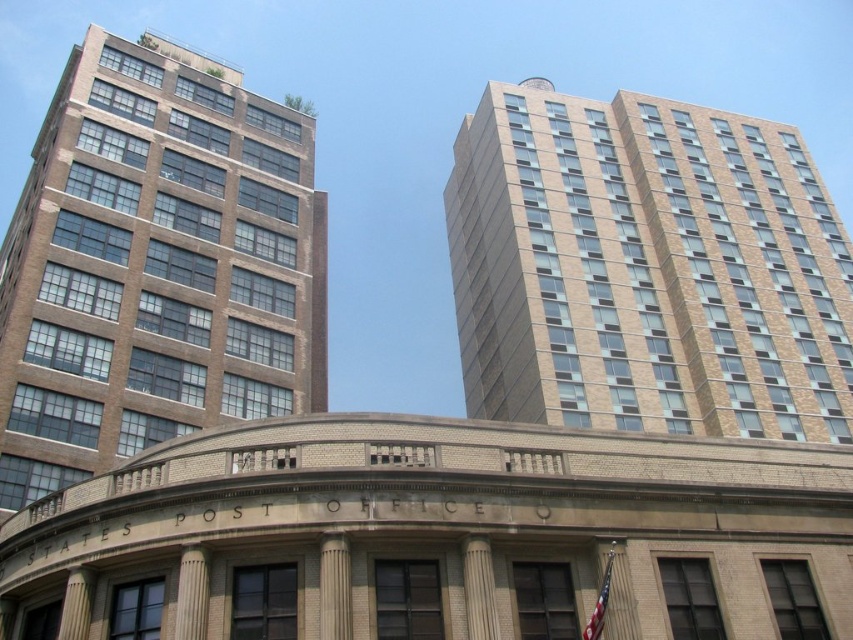
You are standing in front of the historic building and notice two columns at the center. Which column is closer to you, the smooth stone column at center or the white marble column at center?

The smooth stone column at center is closer to you because it is in front of the white marble column at center.

You are standing in front of the historic United States Post Office and want to determine the relative positions of two points marked in the scene. Which of the two points, point (474, 620) or point (177, 636), is closer to you?

Point (474, 620) is closer to you because it is further to the viewer than point (177, 636).

You are an architect analyzing the image. You need to determine which object occupies more horizontal space in the scene. Based on the provided information, which one is wider between the beige brick building at upper right and the smooth stone column at center?

The beige brick building at upper right is wider than the smooth stone column at center according to the description.